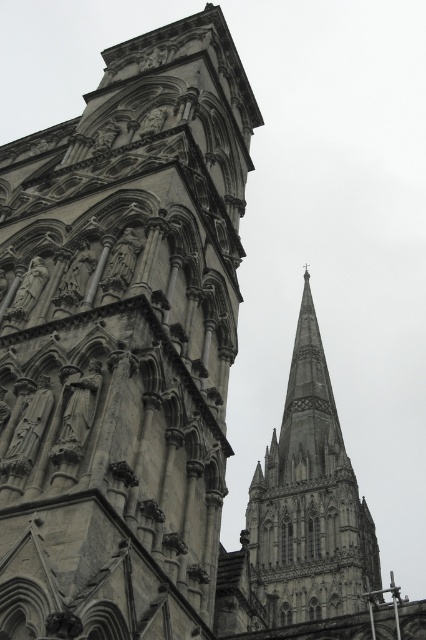
Question: Can you confirm if stone carvings at center is wider than gray stone spire at upper center?

Choices:
 (A) yes
 (B) no

Answer: (B)

Question: Does stone carvings at center come behind gray stone spire at upper center?

Choices:
 (A) yes
 (B) no

Answer: (B)

Question: Which point is farther to the camera?

Choices:
 (A) (250, 545)
 (B) (149, 410)

Answer: (A)

Question: Does stone carvings at center come behind gray stone spire at upper center?

Choices:
 (A) no
 (B) yes

Answer: (A)